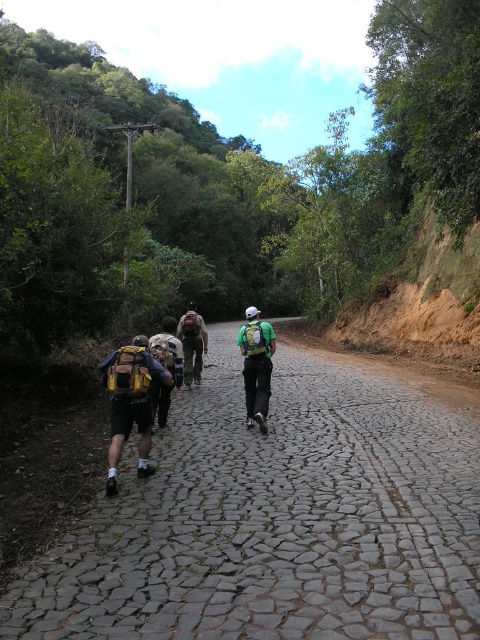
Which is in front, point (144, 412) or point (200, 337)?

Positioned in front is point (144, 412).

Who is more forward, (120, 442) or (178, 337)?

Positioned in front is point (120, 442).

The width and height of the screenshot is (480, 640). In order to click on matte yellow backpack at center in this screenshot , I will do `click(131, 403)`.

Does gray cobblestone path at center appear over matte yellow backpack at center?

Incorrect, gray cobblestone path at center is not positioned above matte yellow backpack at center.

Can you confirm if gray cobblestone path at center is thinner than matte yellow backpack at center?

In fact, gray cobblestone path at center might be wider than matte yellow backpack at center.

Who is more distant from viewer, (402,536) or (128,380)?

The point (128,380) is behind.

Where is `gray cobblestone path at center`? The height and width of the screenshot is (640, 480). gray cobblestone path at center is located at coordinates (278, 516).

Is gray cobblestone path at center shorter than camouflage fabric backpack at center?

Indeed, gray cobblestone path at center has a lesser height compared to camouflage fabric backpack at center.

Is gray cobblestone path at center further to the viewer compared to camouflage fabric backpack at center?

No, gray cobblestone path at center is in front of camouflage fabric backpack at center.

Which is behind, point (414, 392) or point (197, 317)?

The point (197, 317) is more distant.

You are a GUI agent. You are given a task and a screenshot of the screen. Output one action in this format:
    pyautogui.click(x=<x>, y=<y>)
    Task: Click on the gray cobblestone path at center
    
    Given the screenshot: What is the action you would take?
    pyautogui.click(x=278, y=516)